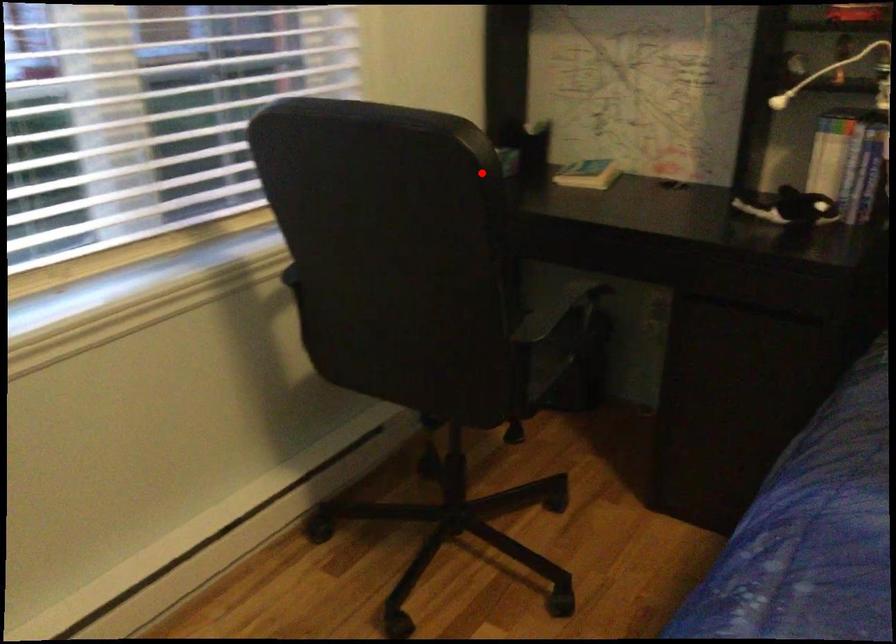
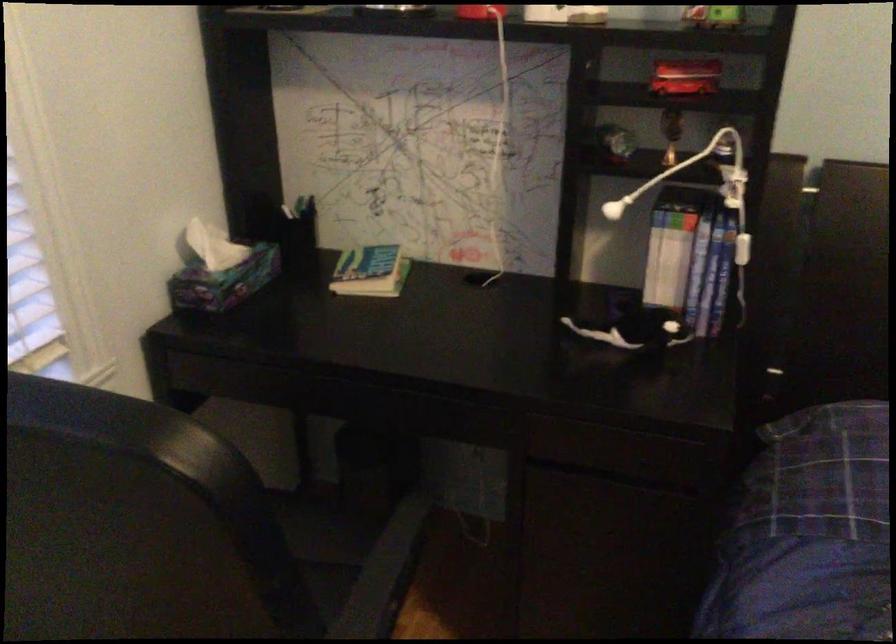
Where in the second image is the point corresponding to the highlighted location from the first image?

(234, 509)